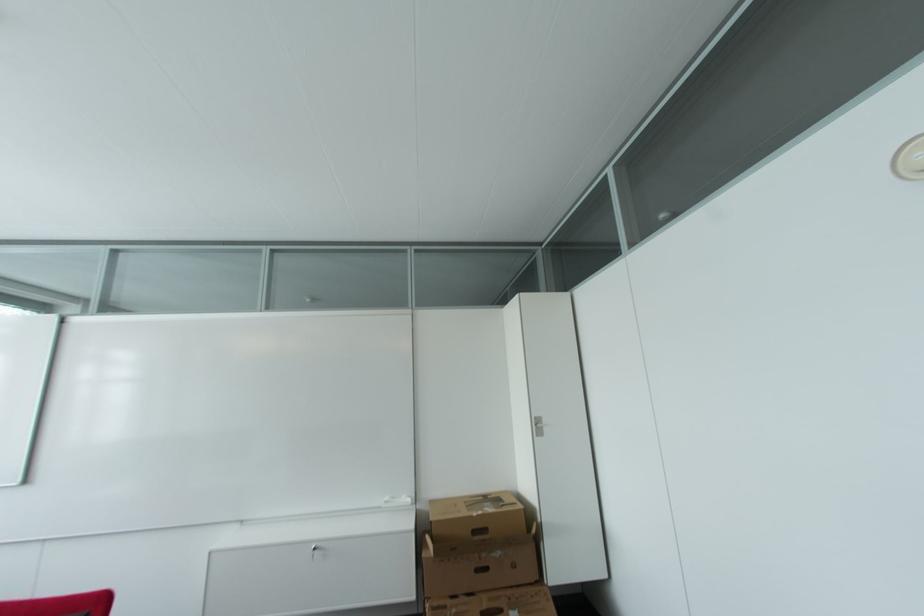
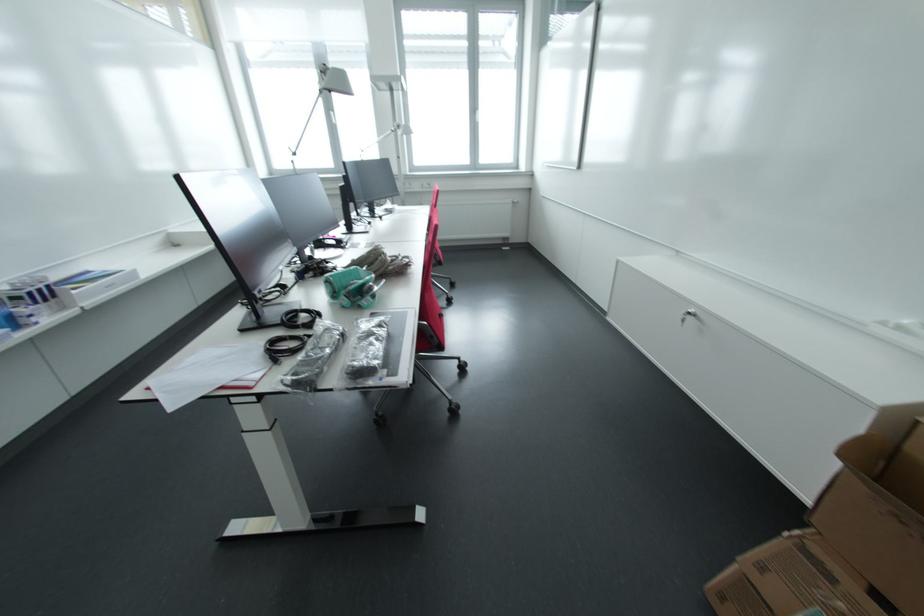
The point at (x=318, y=551) is marked in the first image. Where is the corresponding point in the second image?

(694, 315)